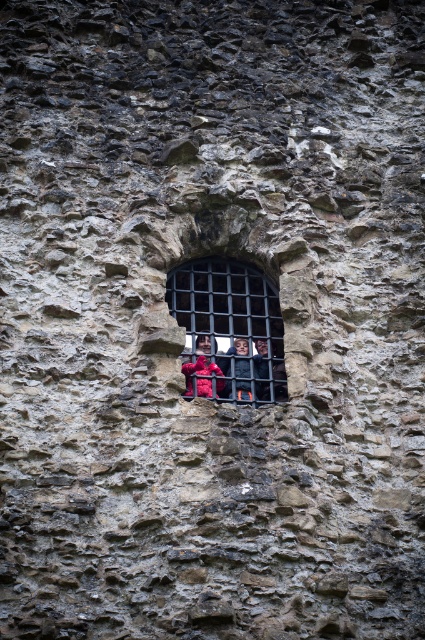
Is black metal bars at center below red jacket at center?

Incorrect, black metal bars at center is not positioned below red jacket at center.

Image resolution: width=425 pixels, height=640 pixels. In order to click on black metal bars at center in this screenshot , I will do `click(229, 330)`.

Which is more to the right, red jacket at center or red fabric person at center?

From the viewer's perspective, red jacket at center appears more on the right side.

What do you see at coordinates (240, 369) in the screenshot?
I see `red jacket at center` at bounding box center [240, 369].

Who is more distant from viewer, (240, 360) or (200, 337)?

Positioned behind is point (200, 337).

The width and height of the screenshot is (425, 640). Identify the location of red jacket at center. (240, 369).

Can you confirm if black metal bars at center is wider than red fabric person at center?

Yes, black metal bars at center is wider than red fabric person at center.

Where is `black metal bars at center`? black metal bars at center is located at coordinates (229, 330).